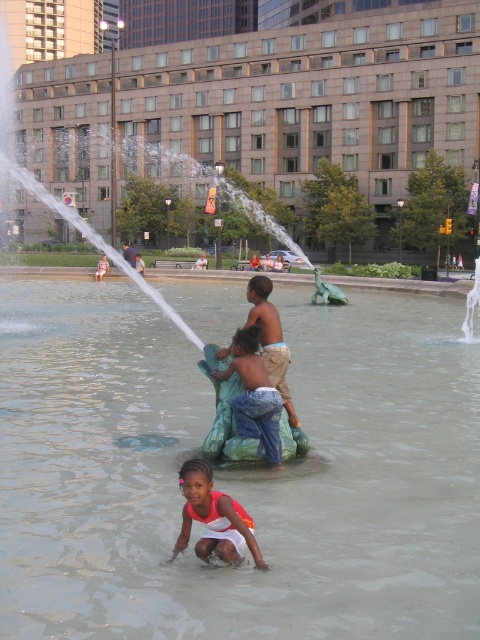
You are a photographer trying to capture a shot of the clear water at center and the white cotton dress at lower center. Based on their positions, which object is located to the right side of the other?

The clear water at center is located to the right of the white cotton dress at lower center.

You are a photographer positioned at the edge of the fountain. You want to capture a photo of the clear water at center and the white cotton dress at lower center. Which object will appear closer to the camera in the photo?

The clear water at center will appear closer to the camera in the photo because it is in front of the white cotton dress at lower center.

You are a parent at the fountain and see the white cotton dress at lower center and the smooth skin child at center. Which item is closer to the edge of the fountain?

The white cotton dress at lower center is positioned under smooth skin child at center, meaning the dress is closer to the edge than the child.